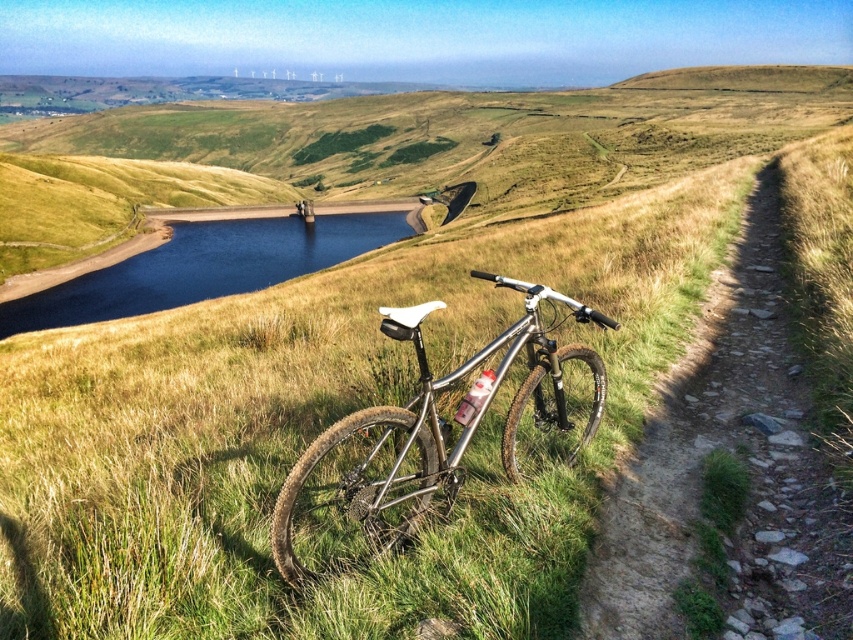
You are a hiker who wants to take a photo of the silver metallic mountain bike at center and the smooth dark blue water at center. Which object should you focus on first if you want to capture both in one shot without moving the camera?

You should focus on the silver metallic mountain bike at center first because it is positioned to the right of the smooth dark blue water at center, so capturing it first ensures both objects remain in frame.